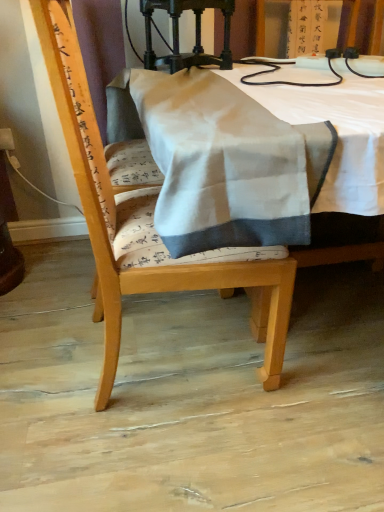
This screenshot has width=384, height=512. What are the coordinates of `vacant space in front of wooden chair at center` in the screenshot? It's located at (183, 453).